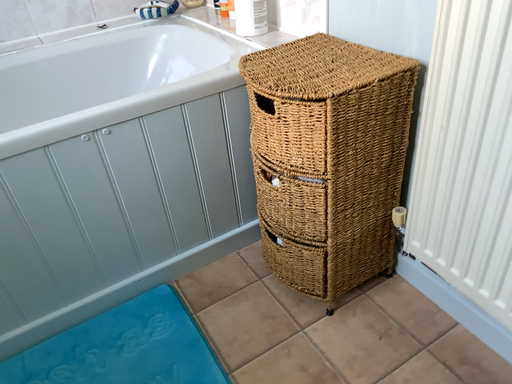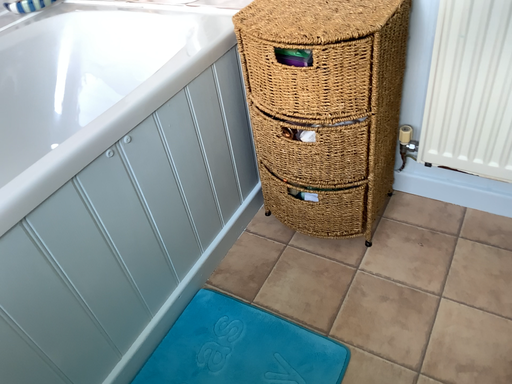
Question: Which way did the camera rotate in the video?

Choices:
 (A) rotated left
 (B) rotated right

Answer: (B)